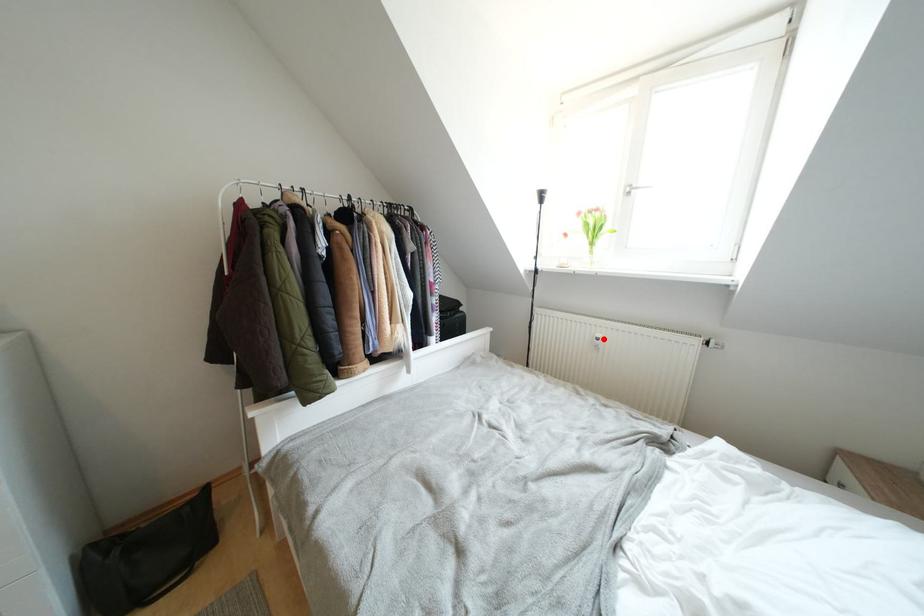
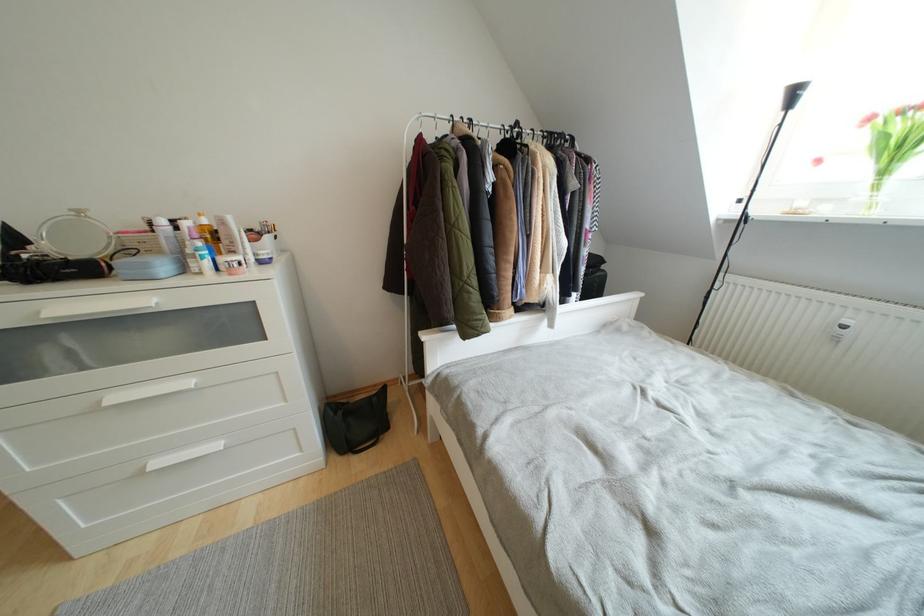
Question: I am providing you with two images of the same scene from different viewpoints. Image1 has a red point marked. In image2, the corresponding 3D location appears at what relative position? Reply with the corresponding letter.

Choices:
 (A) Closer
 (B) Farther

Answer: (B)